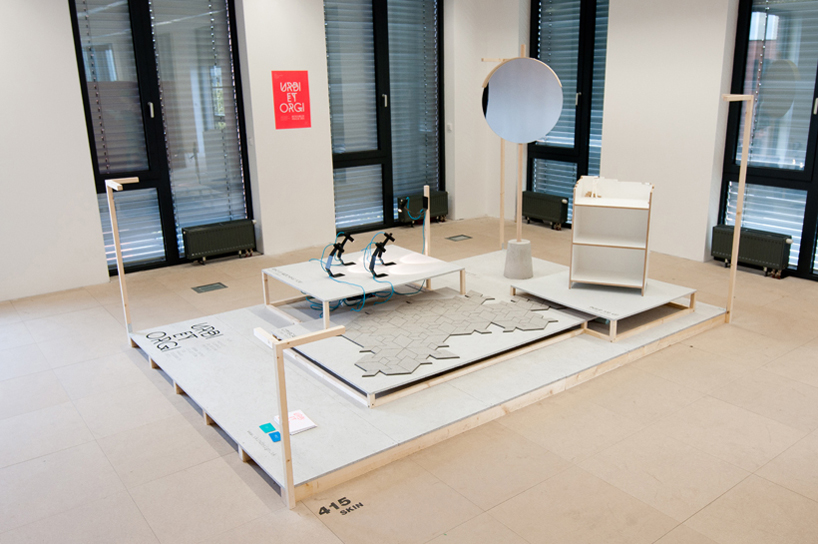
Where is `floor to the left of display`? This screenshot has width=818, height=544. floor to the left of display is located at coordinates (73, 448).